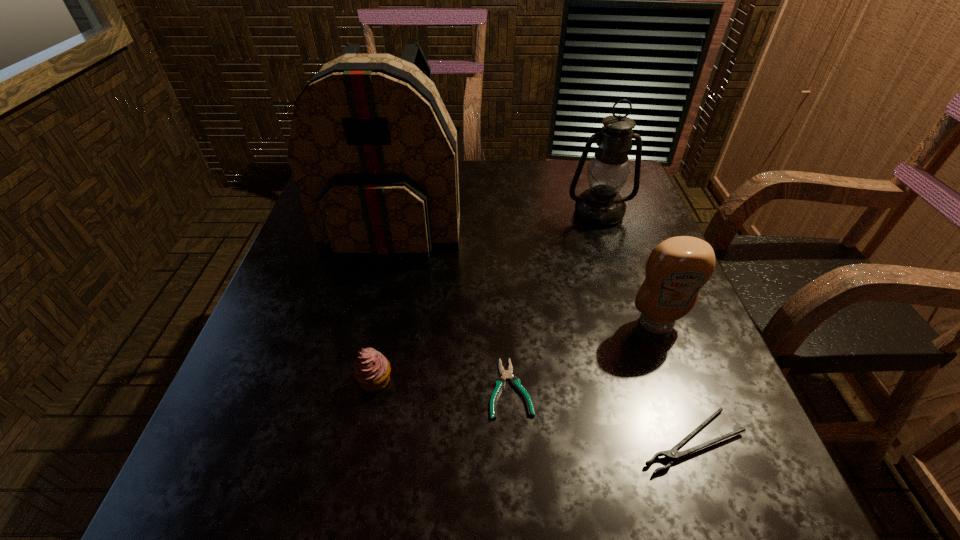
The image size is (960, 540). I want to click on free space located on the label of the condiment, so click(692, 420).

At what (x,y) coordinates should I click in order to perform the action: click on free space located 0.090m on the left of the fourth tallest object. Please return your answer as a coordinate pair (x, y). The image size is (960, 540). Looking at the image, I should click on (308, 380).

Where is `free location located on the left of the second shortest object`? free location located on the left of the second shortest object is located at coordinates (571, 441).

This screenshot has height=540, width=960. I want to click on free spot located 0.220m on the left of the pliers, so click(369, 388).

I want to click on backpack at the far edge, so click(x=373, y=151).

Image resolution: width=960 pixels, height=540 pixels. In order to click on oil lamp that is positioned at the far edge in this screenshot , I will do tap(602, 205).

Find the location of `object that is at the near edge`. object that is at the near edge is located at coordinates (672, 454).

The image size is (960, 540). Find the location of `object situated at the left edge`. object situated at the left edge is located at coordinates (373, 151).

The width and height of the screenshot is (960, 540). Find the location of `oil lamp that is at the right edge`. oil lamp that is at the right edge is located at coordinates (602, 205).

This screenshot has width=960, height=540. I want to click on condiment that is at the right edge, so click(x=677, y=268).